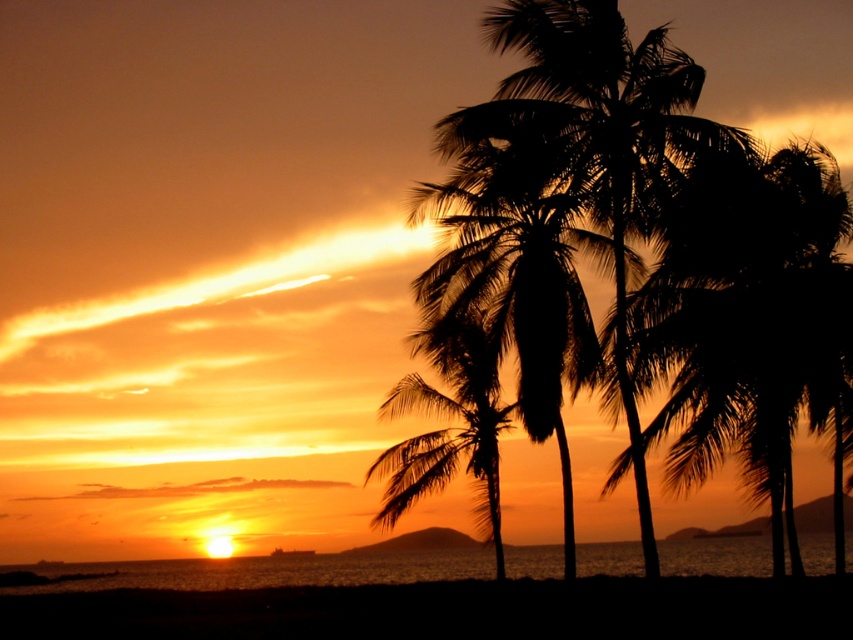
Which is below, silhouette palm trees at right or silhouette leafy palm at center?

silhouette leafy palm at center is lower down.

Does silhouette palm trees at right appear over silhouette leafy palm at center?

Yes.

Which is behind, point (723, 252) or point (480, 339)?

Positioned behind is point (480, 339).

Locate an element on the screen. silhouette palm trees at right is located at coordinates (752, 317).

Which is behind, point (498, 173) or point (448, 208)?

Point (448, 208)

Does black silhouette coconut tree at right have a lesser width compared to silhouette palm trees at center?

No.

Image resolution: width=853 pixels, height=640 pixels. What do you see at coordinates (646, 243) in the screenshot?
I see `black silhouette coconut tree at right` at bounding box center [646, 243].

At what (x,y) coordinates should I click in order to perform the action: click on black silhouette coconut tree at right. Please return your answer as a coordinate pair (x, y). Looking at the image, I should click on (646, 243).

Is black silhouette coconut tree at right to the left of silhouette palm trees at right from the viewer's perspective?

Yes, black silhouette coconut tree at right is to the left of silhouette palm trees at right.

You are a GUI agent. You are given a task and a screenshot of the screen. Output one action in this format:
    pyautogui.click(x=<x>, y=<y>)
    Task: Click on the black silhouette coconut tree at right
    The height and width of the screenshot is (640, 853).
    Given the screenshot: What is the action you would take?
    coord(646,243)

Describe the element at coordinates (646, 243) in the screenshot. I see `black silhouette coconut tree at right` at that location.

At what (x,y) coordinates should I click in order to perform the action: click on black silhouette coconut tree at right. Please return your answer as a coordinate pair (x, y). Image resolution: width=853 pixels, height=640 pixels. Looking at the image, I should click on (646, 243).